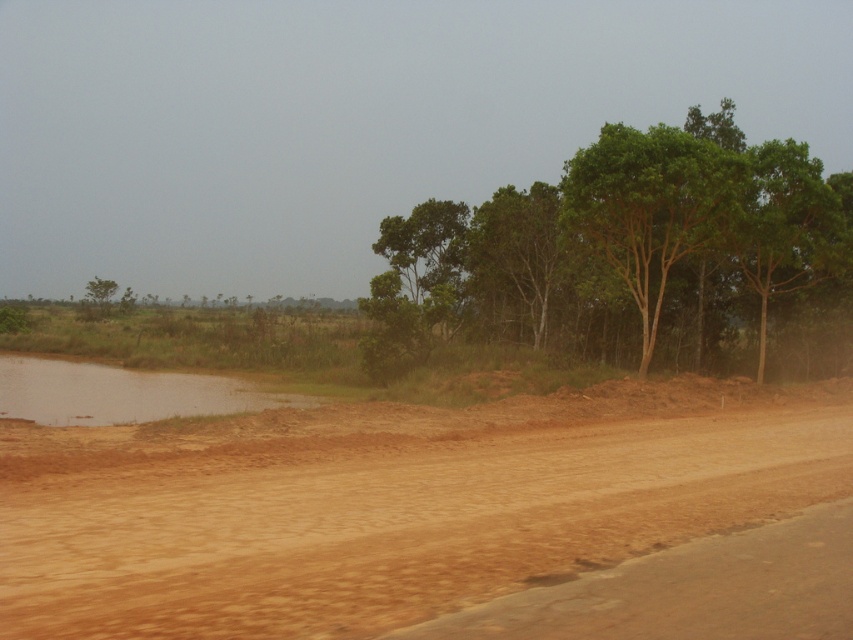
From the picture: You are standing at the center of the dirt road in the rural landscape. You want to walk to the green leafy tree at right. Which direction should you head?

You should head to the right direction since the green leafy tree at right is located at the right side of the road.

You are a hiker standing on the dirt road in the rural landscape. You see the green leafy trees at center and the green leafy tree at center. Which one is located to the right side of the other?

The green leafy trees at center is positioned on the right side of green leafy tree at center.

You are a hiker trying to cross the dirt road in the image. You notice two paths marked by green leafy trees at center and green leafy tree at center. Which path is wider?

The green leafy trees at center form a wider path than the green leafy tree at center because their combined width surpasses the single tree.